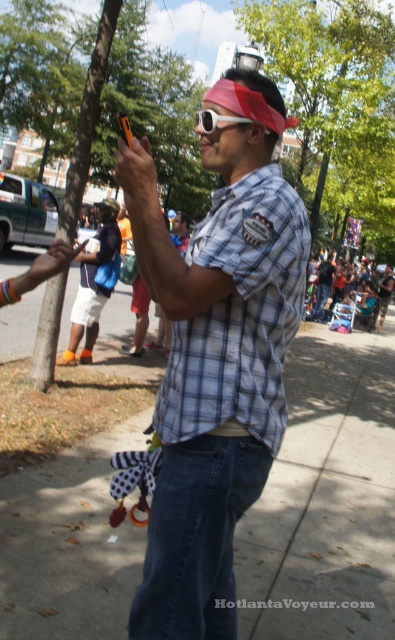
Describe the element at coordinates (327, 497) in the screenshot. Image resolution: width=395 pixels, height=640 pixels. I see `smooth concrete sidewalk at center` at that location.

This screenshot has height=640, width=395. What are the coordinates of `smooth concrete sidewalk at center` in the screenshot? It's located at (327, 497).

Which is below, gray checkered shirt at center or matte orange pen at upper left?

gray checkered shirt at center is lower down.

What do you see at coordinates (240, 316) in the screenshot? I see `gray checkered shirt at center` at bounding box center [240, 316].

What do you see at coordinates (240, 316) in the screenshot? I see `gray checkered shirt at center` at bounding box center [240, 316].

Where is `gray checkered shirt at center`? The width and height of the screenshot is (395, 640). gray checkered shirt at center is located at coordinates (240, 316).

Does smooth concrete sidewalk at center come in front of matte orange pen at upper left?

No, it is not.

Does smooth concrete sidewalk at center appear over matte orange pen at upper left?

Incorrect, smooth concrete sidewalk at center is not positioned above matte orange pen at upper left.

Where is `smooth concrete sidewalk at center`? The width and height of the screenshot is (395, 640). smooth concrete sidewalk at center is located at coordinates (327, 497).